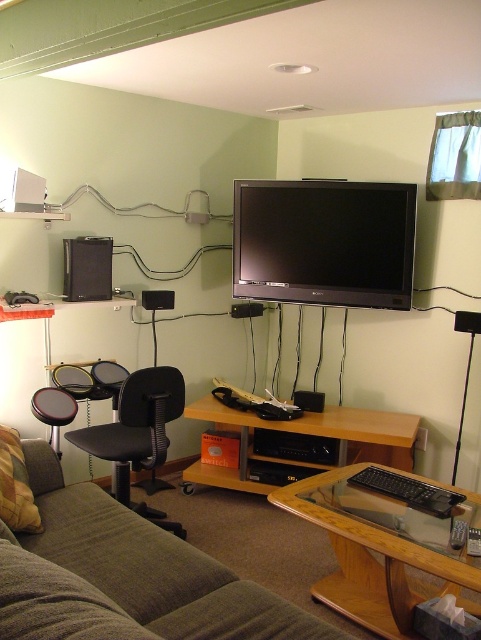
Does flat screen tv at upper center have a smaller size compared to black plastic speaker at upper left?

Actually, flat screen tv at upper center might be larger than black plastic speaker at upper left.

Between point (265, 188) and point (108, 248), which one is positioned in front?

Point (108, 248) is in front.

The image size is (481, 640). What are the coordinates of `flat screen tv at upper center` in the screenshot? It's located at [x=324, y=243].

Is flat screen tv at upper center bigger than woodendesk at lower center?

No.

Does flat screen tv at upper center have a lesser height compared to woodendesk at lower center?

Incorrect, flat screen tv at upper center's height does not fall short of woodendesk at lower center's.

You are a GUI agent. You are given a task and a screenshot of the screen. Output one action in this format:
    pyautogui.click(x=<x>, y=<y>)
    Task: Click on the flat screen tv at upper center
    The image size is (481, 640).
    Given the screenshot: What is the action you would take?
    pyautogui.click(x=324, y=243)

Is point (152, 544) farther from camera compared to point (98, 256)?

No, (152, 544) is in front of (98, 256).

Which is below, dark gray fabric couch at lower left or black plastic speaker at upper left?

dark gray fabric couch at lower left is below.

Which is in front, point (298, 625) or point (70, 296)?

Point (298, 625) is more forward.

Where is `dark gray fabric couch at lower left`? dark gray fabric couch at lower left is located at coordinates (151, 566).